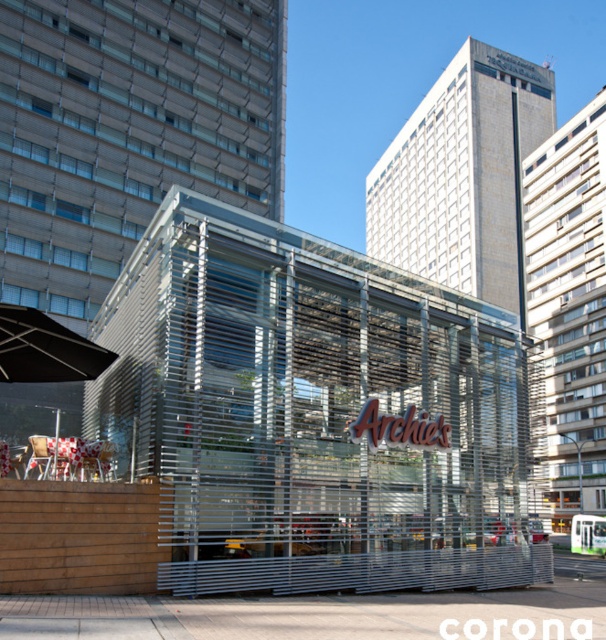
You are standing in the urban setting and want to determine which of the two points, point (52,460) or point (107,458), is nearer to you. Based on the scene, which point is closer?

Point (52,460) is closer to the camera than point (107,458), so it is the nearer one.

You are a customer looking for a seat at Archie s restaurant. You see the black matte umbrella at left and the white glossy chair at lower left. Which object is closer to the entrance of the restaurant?

The white glossy chair at lower left is closer to the entrance of the restaurant because the black matte umbrella at left is positioned on the left side of it, meaning the chair is between the entrance and the umbrella.